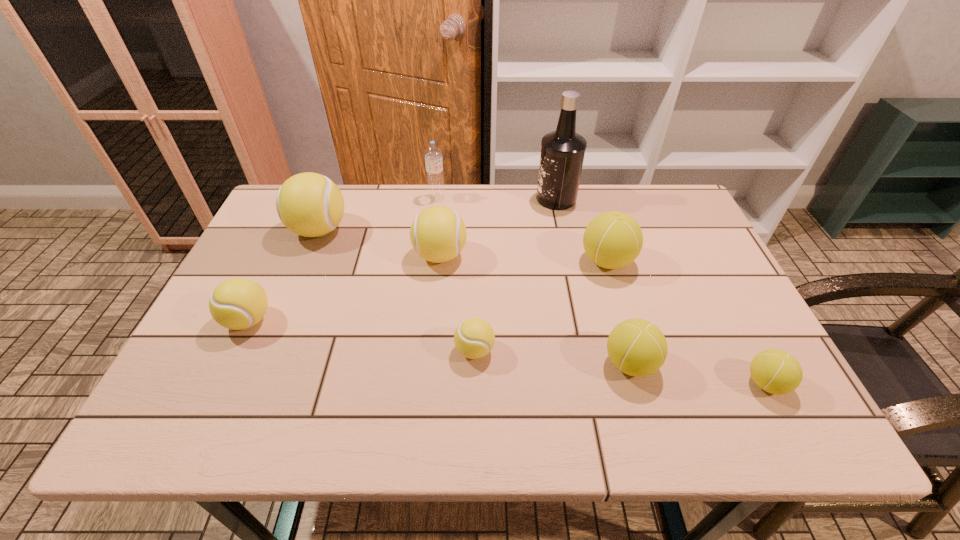
Identify which green tennis ball is the nearest to the second smallest yellow tennis ball. Please provide its 2D coordinates. Your answer should be formatted as a tuple, i.e. [(x, y)], where the tuple contains the x and y coordinates of a point satisfying the conditions above.

[(637, 347)]

Locate an element on the screen. The width and height of the screenshot is (960, 540). free spot that satisfies the following two spatial constraints: 1. on the front side of the third biggest yellow tennis ball; 2. on the left side of the rightmost tennis ball is located at coordinates (218, 383).

Locate an element on the screen. vacant space that satisfies the following two spatial constraints: 1. on the back side of the water bottle; 2. on the left side of the biggest yellow tennis ball is located at coordinates (332, 198).